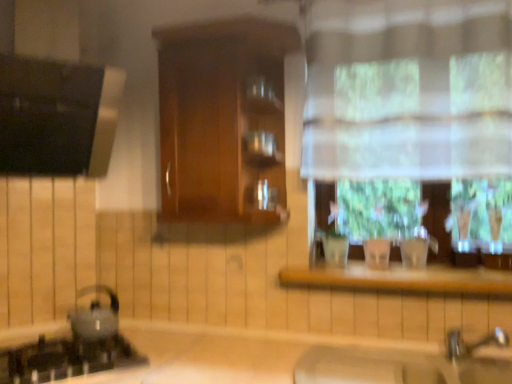
Question: Is black glass gas stove at lower left next to beige matte sink at lower center and touching it?

Choices:
 (A) yes
 (B) no

Answer: (B)

Question: Does black glass gas stove at lower left lie in front of beige matte sink at lower center?

Choices:
 (A) yes
 (B) no

Answer: (B)

Question: From the image's perspective, is black glass gas stove at lower left under beige matte sink at lower center?

Choices:
 (A) yes
 (B) no

Answer: (B)

Question: Would you say black glass gas stove at lower left is a long distance from beige matte sink at lower center?

Choices:
 (A) no
 (B) yes

Answer: (A)

Question: Is black glass gas stove at lower left taller than beige matte sink at lower center?

Choices:
 (A) no
 (B) yes

Answer: (A)

Question: Does black glass gas stove at lower left appear on the right side of beige matte sink at lower center?

Choices:
 (A) no
 (B) yes

Answer: (A)

Question: Is black glass gas stove at lower left located outside shiny metallic kettle at lower left?

Choices:
 (A) yes
 (B) no

Answer: (A)

Question: From the image's perspective, is black glass gas stove at lower left located above shiny metallic kettle at lower left?

Choices:
 (A) yes
 (B) no

Answer: (B)

Question: Could shiny metallic kettle at lower left be considered to be inside black glass gas stove at lower left?

Choices:
 (A) yes
 (B) no

Answer: (B)

Question: Considering the relative positions of black glass gas stove at lower left and shiny metallic kettle at lower left in the image provided, is black glass gas stove at lower left in front of shiny metallic kettle at lower left?

Choices:
 (A) yes
 (B) no

Answer: (A)

Question: Does black glass gas stove at lower left have a greater width compared to shiny metallic kettle at lower left?

Choices:
 (A) no
 (B) yes

Answer: (B)

Question: Is black glass gas stove at lower left further to camera compared to shiny metallic kettle at lower left?

Choices:
 (A) yes
 (B) no

Answer: (B)

Question: Does shiny metallic kettle at lower left have a larger size compared to black glass gas stove at lower left?

Choices:
 (A) no
 (B) yes

Answer: (A)